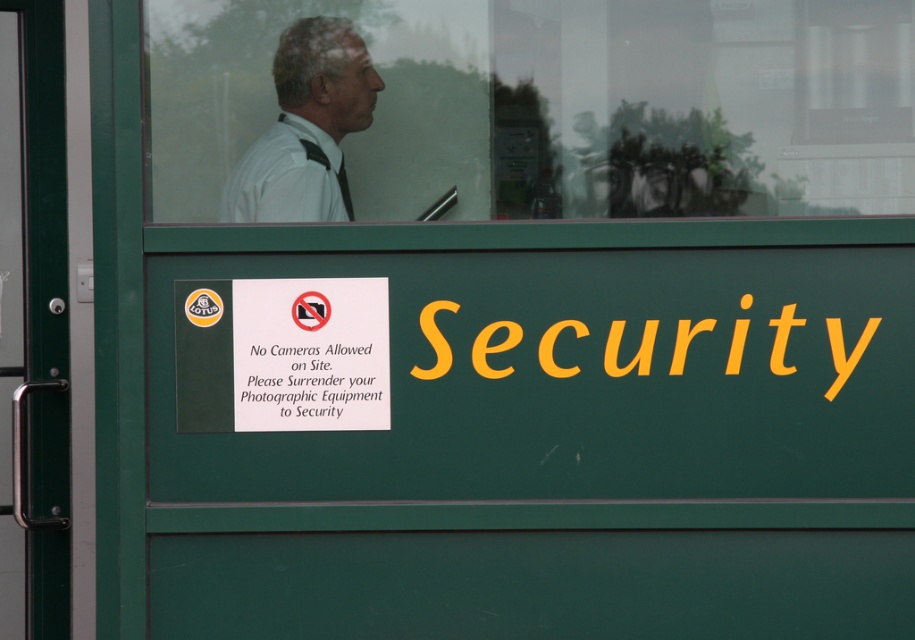
Question: Which object is farther from the camera taking this photo?

Choices:
 (A) yellow matte security at center
 (B) white shirt at upper center
 (C) green metallic door at left
 (D) transparent glass window at upper center

Answer: (C)

Question: Which point is closer to the camera?

Choices:
 (A) yellow matte security at center
 (B) white paper at upper center
 (C) transparent glass window at upper center

Answer: (A)

Question: Can you confirm if white shirt at upper center is positioned to the right of white matte dress shirt at upper center?

Choices:
 (A) no
 (B) yes

Answer: (B)

Question: Which point is farther from the camera taking this photo?

Choices:
 (A) (681, 356)
 (B) (303, 72)
 (C) (454, 33)
 (D) (310, 344)

Answer: (C)

Question: Is white shirt at upper center positioned in front of yellow matte security at center?

Choices:
 (A) yes
 (B) no

Answer: (B)

Question: Is transparent glass window at upper center positioned before green metallic door at left?

Choices:
 (A) no
 (B) yes

Answer: (B)